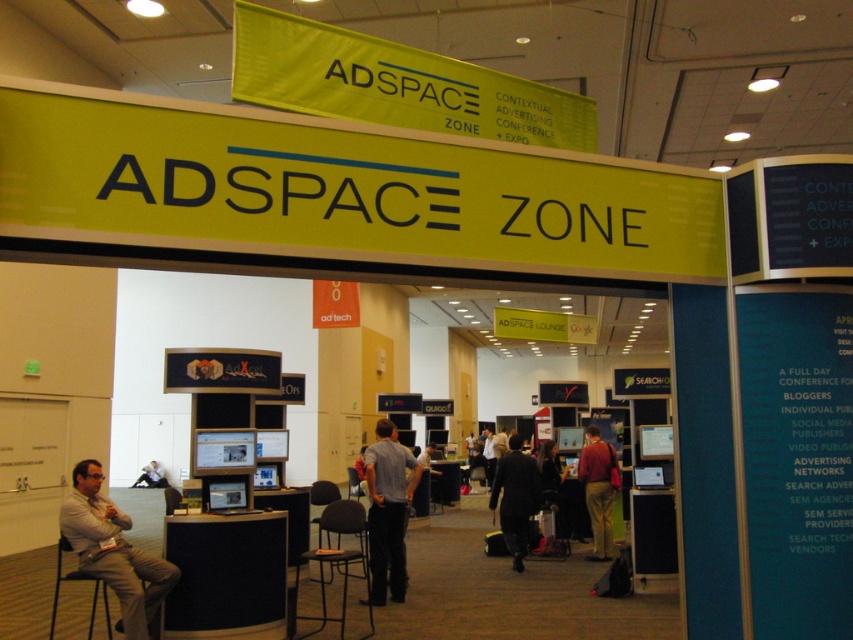
Question: Can you confirm if matte red shirt at center is thinner than dark gray suit at center?

Choices:
 (A) no
 (B) yes

Answer: (B)

Question: Is light brown fabric pants at lower left to the left of gray cotton shirt at center from the viewer's perspective?

Choices:
 (A) no
 (B) yes

Answer: (B)

Question: Is dark gray suit at center above light brown leather jacket at lower left?

Choices:
 (A) no
 (B) yes

Answer: (B)

Question: Which point is closer to the camera?

Choices:
 (A) (553, 460)
 (B) (273, 560)
 (C) (491, 506)

Answer: (B)

Question: Based on their relative distances, which object is nearer to the dark suit at center?

Choices:
 (A) light brown leather jacket at lower left
 (B) matte red shirt at center
 (C) gray cotton shirt at center

Answer: (B)

Question: Among these objects, which one is nearest to the camera?

Choices:
 (A) dark suit at center
 (B) black fabric information desk at lower left
 (C) light brown leather jacket at lower left

Answer: (B)